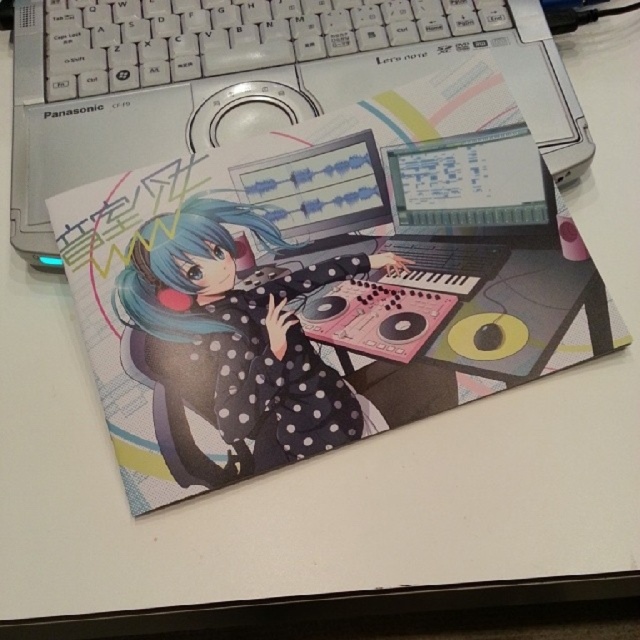
Question: Is white plastic keyboard at upper center bigger than matte black laptop at center?

Choices:
 (A) yes
 (B) no

Answer: (A)

Question: Is silver metallic laptop at upper center to the right of blue matte hair at center from the viewer's perspective?

Choices:
 (A) yes
 (B) no

Answer: (A)

Question: Estimate the real-world distances between objects in this image. Which object is closer to the matte black laptop at center?

Choices:
 (A) blue matte hair at center
 (B) white plastic keyboard at upper center

Answer: (A)

Question: Which object is farther from the camera taking this photo?

Choices:
 (A) white plastic keyboard at upper center
 (B) matte black laptop at center
 (C) silver metallic laptop at upper center
 (D) polka dot fabric girl at center

Answer: (A)

Question: Which is nearer to the matte black laptop at center?

Choices:
 (A) silver metallic laptop at upper center
 (B) blue matte hair at center

Answer: (A)

Question: Is white plastic keyboard at upper center to the right of blue matte hair at center from the viewer's perspective?

Choices:
 (A) yes
 (B) no

Answer: (A)